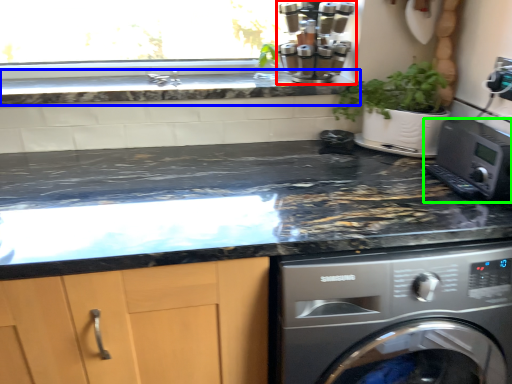
Question: Considering the real-world distances, which object is closest to coffee machine (highlighted by a red box)? countertop (highlighted by a blue box) or home appliance (highlighted by a green box).

Choices:
 (A) countertop
 (B) home appliance

Answer: (A)